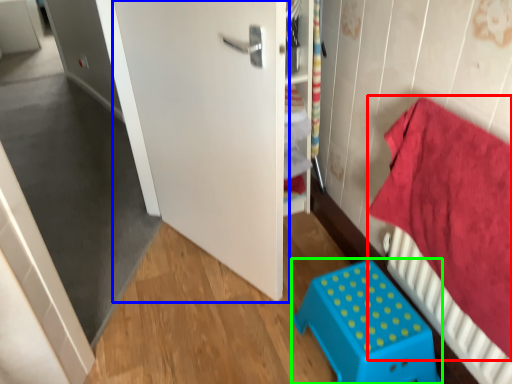
Question: Based on their relative distances, which object is nearer to bedding (highlighted by a red box)? Choose from door (highlighted by a blue box) and furniture (highlighted by a green box).

Choices:
 (A) door
 (B) furniture

Answer: (B)